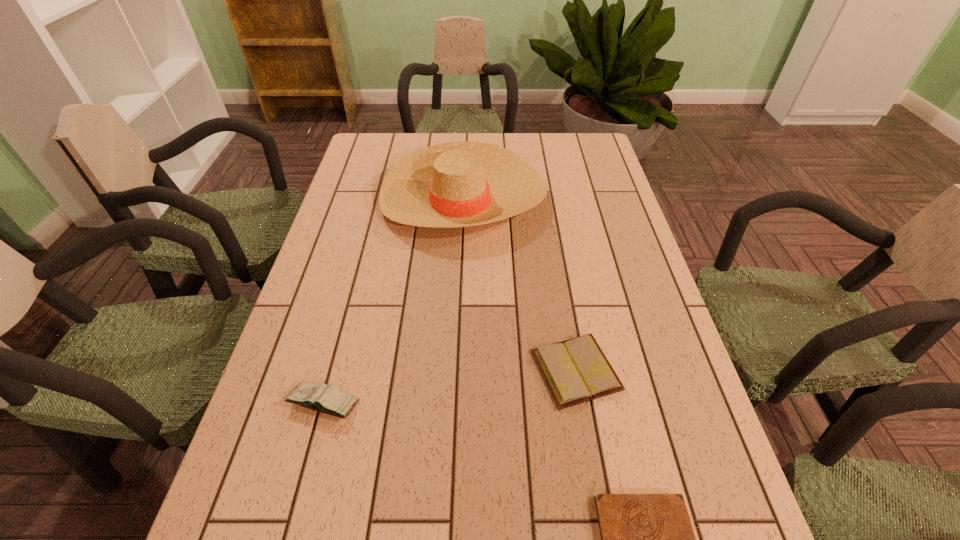
Identify the location of object present at the far left corner. Image resolution: width=960 pixels, height=540 pixels. (458, 184).

In order to click on vacant space at the left edge in this screenshot , I will do `click(293, 525)`.

At what (x,y) coordinates should I click in order to perform the action: click on free space at the right edge of the desktop. Please return your answer as a coordinate pair (x, y). This screenshot has height=540, width=960. Looking at the image, I should click on (739, 538).

The image size is (960, 540). I want to click on vacant space at the far left corner of the desktop, so click(x=370, y=145).

At what (x,y) coordinates should I click in order to perform the action: click on vacant space at the far right corner of the desktop. Please return your answer as a coordinate pair (x, y). This screenshot has width=960, height=540. Looking at the image, I should click on (561, 141).

The height and width of the screenshot is (540, 960). What are the coordinates of `free spot between the third shortest object and the sunhat` in the screenshot? It's located at (395, 301).

At what (x,y) coordinates should I click in order to perform the action: click on free space between the farthest object and the leftmost diary. Please return your answer as a coordinate pair (x, y). This screenshot has height=540, width=960. Looking at the image, I should click on (395, 301).

At what (x,y) coordinates should I click in order to perform the action: click on free space between the sunhat and the second tallest object. Please return your answer as a coordinate pair (x, y). This screenshot has width=960, height=540. Looking at the image, I should click on (395, 301).

Identify which object is the second nearest to the nearest object. Please provide its 2D coordinates. Your answer should be formatted as a tuple, i.e. [(x, y)], where the tuple contains the x and y coordinates of a point satisfying the conditions above.

[(326, 399)]

The height and width of the screenshot is (540, 960). In order to click on object that can be found as the third closest to the tallest object in this screenshot , I will do `click(646, 539)`.